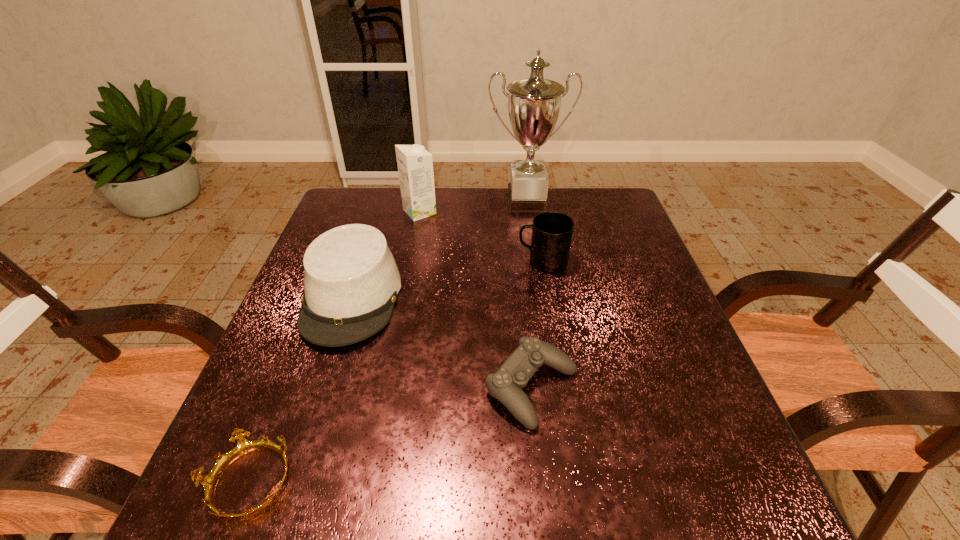
At what (x,y) coordinates should I click in order to perform the action: click on vacant space that is in between the tallest object and the fifth shortest object. Please return your answer as a coordinate pair (x, y). Looking at the image, I should click on (473, 206).

Locate an element on the screen. The image size is (960, 540). vacant region between the fifth shortest object and the mug is located at coordinates click(x=481, y=237).

Where is `free space that is in between the carton and the control`? Image resolution: width=960 pixels, height=540 pixels. free space that is in between the carton and the control is located at coordinates (476, 300).

You are a GUI agent. You are given a task and a screenshot of the screen. Output one action in this format:
    pyautogui.click(x=<x>, y=<y>)
    Task: Click on the free space between the second tallest object and the trophy cup
    The height and width of the screenshot is (540, 960).
    Given the screenshot: What is the action you would take?
    point(473,206)

Where is `free point between the control and the trophy cup`? Image resolution: width=960 pixels, height=540 pixels. free point between the control and the trophy cup is located at coordinates (529, 294).

Identify the location of object that stands as the third closest to the crown. (552, 232).

Find the location of a particular element. This screenshot has width=960, height=540. object that can be found as the closest to the crown is located at coordinates (351, 281).

Locate an element on the screen. The width and height of the screenshot is (960, 540). free space that satisfies the following two spatial constraints: 1. on the front-facing side of the control; 2. on the left side of the hat is located at coordinates (323, 388).

At what (x,y) coordinates should I click in order to perform the action: click on free space that satisfies the following two spatial constraints: 1. on the back side of the control; 2. on the left side of the crown. Please return your answer as a coordinate pair (x, y). Looking at the image, I should click on (286, 388).